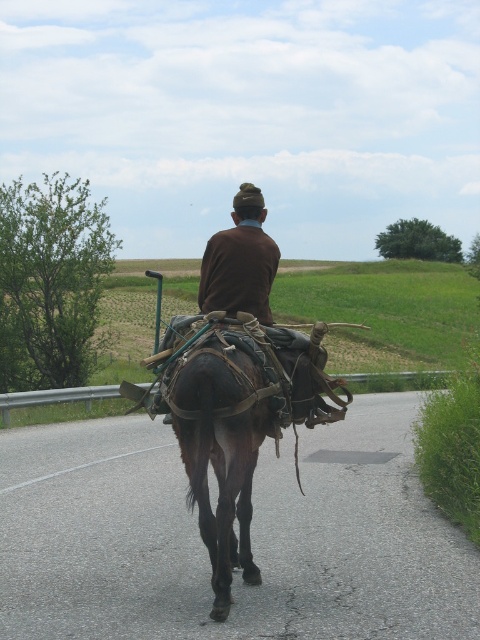
Measure the distance from asphalt road at center to brown wool sweater at center.

The distance of asphalt road at center from brown wool sweater at center is 3.04 meters.

Between asphalt road at center and brown wool sweater at center, which one has more height?

brown wool sweater at center is taller.

Which is in front, point (321, 541) or point (263, 236)?

Positioned in front is point (263, 236).

Where is `asphalt road at center`? asphalt road at center is located at coordinates (252, 536).

Is point (225, 513) farther from viewer compared to point (238, 227)?

No, it is not.

Locate an element on the screen. brown leather horse at center is located at coordinates (222, 449).

Is point (215, 620) in front of point (197, 291)?

Yes, it is in front of point (197, 291).

You are a GUI agent. You are given a task and a screenshot of the screen. Output one action in this format:
    pyautogui.click(x=<x>, y=<y>)
    Task: Click on the brown leather horse at center
    
    Given the screenshot: What is the action you would take?
    pyautogui.click(x=222, y=449)

Based on the photo, is asphalt road at center wider than brown leather horse at center?

Correct, the width of asphalt road at center exceeds that of brown leather horse at center.

What do you see at coordinates (252, 536) in the screenshot?
I see `asphalt road at center` at bounding box center [252, 536].

Find the location of a particular element. asphalt road at center is located at coordinates (252, 536).